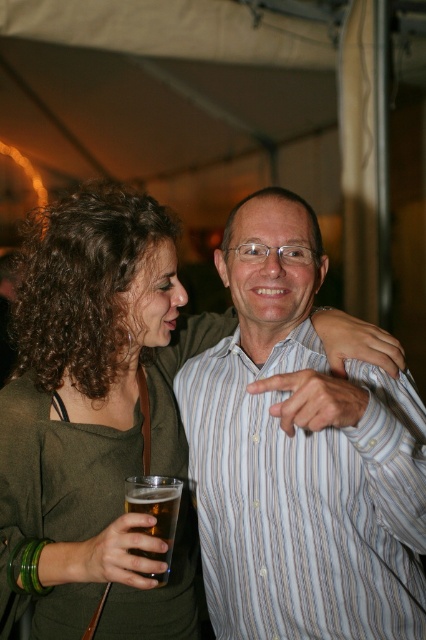
Question: Is striped cotton shirt at center positioned at the back of translucent glass beer at lower left?

Choices:
 (A) no
 (B) yes

Answer: (A)

Question: Considering the relative positions of striped cotton shirt at center and translucent glass beer at lower left in the image provided, where is striped cotton shirt at center located with respect to translucent glass beer at lower left?

Choices:
 (A) right
 (B) left

Answer: (A)

Question: Which point appears closest to the camera in this image?

Choices:
 (A) coord(161,557)
 (B) coord(383,557)

Answer: (A)

Question: Which object appears farthest from the camera in this image?

Choices:
 (A) translucent glass beer at lower left
 (B) striped cotton shirt at center

Answer: (A)

Question: Is striped cotton shirt at center positioned in front of translucent glass beer at lower left?

Choices:
 (A) yes
 (B) no

Answer: (A)